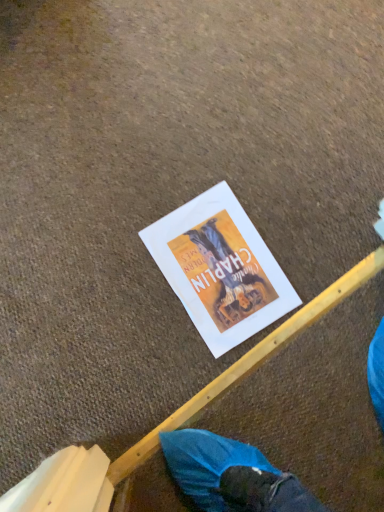
What is the approximate width of matte paper flyer at center?

It is 12.15 inches.

At what (x,y) coordinates should I click in order to perform the action: click on matte paper flyer at center. Please return your answer as a coordinate pair (x, y). The height and width of the screenshot is (512, 384). Looking at the image, I should click on (220, 268).

What do you see at coordinates (220, 268) in the screenshot? This screenshot has width=384, height=512. I see `matte paper flyer at center` at bounding box center [220, 268].

Locate an element on the screen. The width and height of the screenshot is (384, 512). matte paper flyer at center is located at coordinates (220, 268).